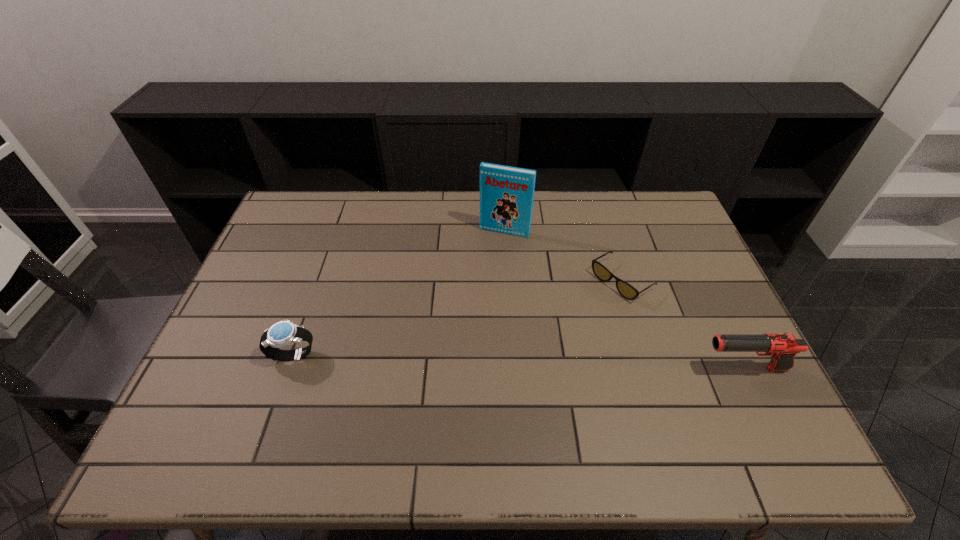
Where is `free space between the second farthest object and the leftmost object`? free space between the second farthest object and the leftmost object is located at coordinates (458, 318).

Where is `vacant space that is in between the rightmost object and the sunglasses`? Image resolution: width=960 pixels, height=540 pixels. vacant space that is in between the rightmost object and the sunglasses is located at coordinates (683, 325).

Identify the location of free space between the watch and the book. The image size is (960, 540). tap(399, 293).

This screenshot has width=960, height=540. Identify the location of vacant area between the third object from right to left and the third tallest object. (399, 293).

This screenshot has height=540, width=960. I want to click on free space that is in between the book and the shortest object, so click(x=564, y=256).

Where is `vacant area that lies between the gun and the book`? The height and width of the screenshot is (540, 960). vacant area that lies between the gun and the book is located at coordinates (624, 300).

Locate an element on the screen. This screenshot has height=540, width=960. vacant area that lies between the gun and the second shortest object is located at coordinates (518, 361).

This screenshot has width=960, height=540. What are the coordinates of `the closest object to the leftmost object` in the screenshot? It's located at (506, 193).

Identify which object is the nearest to the shortest object. Please provide its 2D coordinates. Your answer should be formatted as a tuple, i.e. [(x, y)], where the tuple contains the x and y coordinates of a point satisfying the conditions above.

[(782, 348)]

This screenshot has width=960, height=540. Identify the location of free point that satisfies the following two spatial constraints: 1. on the front side of the gun; 2. at the aiming end of the shortest object. (649, 369).